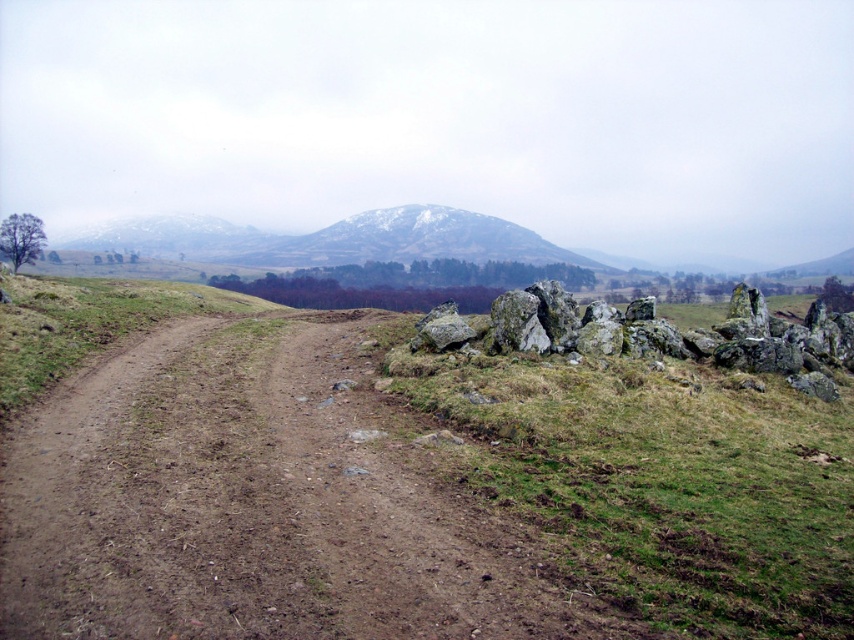
Question: Which object appears closest to the camera in this image?

Choices:
 (A) brown dirt track at center
 (B) rough textured rocks at right

Answer: (A)

Question: Which object is closer to the camera taking this photo?

Choices:
 (A) rough textured rocks at right
 (B) green grassy at right
 (C) brown dirt track at center

Answer: (C)

Question: Is brown dirt track at center to the right of rough textured rocks at right from the viewer's perspective?

Choices:
 (A) yes
 (B) no

Answer: (B)

Question: Considering the relative positions of brown dirt track at center and rough textured rocks at right in the image provided, where is brown dirt track at center located with respect to rough textured rocks at right?

Choices:
 (A) left
 (B) right

Answer: (A)

Question: Can you confirm if green grassy at right is positioned above rough textured rocks at right?

Choices:
 (A) no
 (B) yes

Answer: (A)

Question: Which object appears closest to the camera in this image?

Choices:
 (A) rough textured rocks at right
 (B) green grassy at right

Answer: (B)